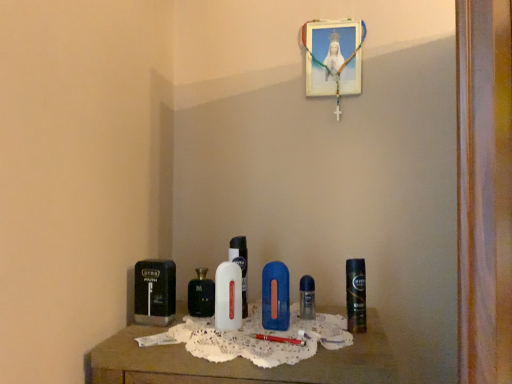
Locate an element on the screen. free space in front of white plastic bottle at center, acting as the third perfume starting from the left is located at coordinates (240, 338).